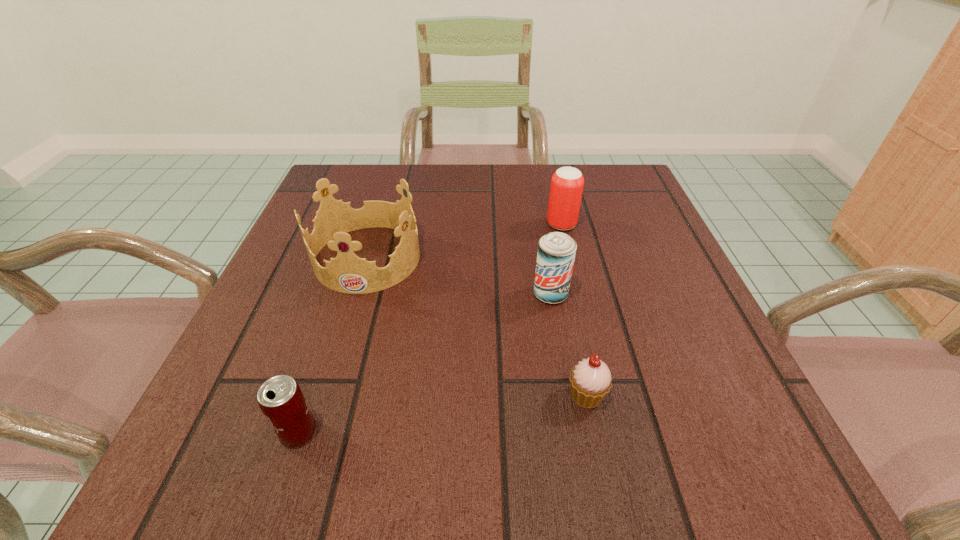
Identify the location of free space at the far left corner. Image resolution: width=960 pixels, height=540 pixels. (337, 178).

The image size is (960, 540). In the image, there is a desktop. What are the coordinates of `blank space at the far right corner` in the screenshot? It's located at (617, 165).

Locate an element on the screen. The width and height of the screenshot is (960, 540). free space at the near right corner of the desktop is located at coordinates (710, 441).

This screenshot has width=960, height=540. I want to click on vacant space that is in between the second nearest beer can and the nearest object, so click(424, 363).

Locate an element on the screen. The image size is (960, 540). vacant space that's between the cupcake and the second farthest beer can is located at coordinates (568, 345).

What are the coordinates of `free spot between the farthest beer can and the cupcake` in the screenshot? It's located at (574, 310).

Find the location of a particular element. The height and width of the screenshot is (540, 960). unoccupied position between the farthest beer can and the second nearest object is located at coordinates (574, 310).

This screenshot has height=540, width=960. In order to click on free spot between the second nearest beer can and the cupcake in this screenshot , I will do `click(568, 345)`.

Find the location of a particular element. vacant space in between the farthest beer can and the tiara is located at coordinates (465, 241).

This screenshot has width=960, height=540. In order to click on empty location between the farthest beer can and the shortest beer can in this screenshot , I will do `click(430, 328)`.